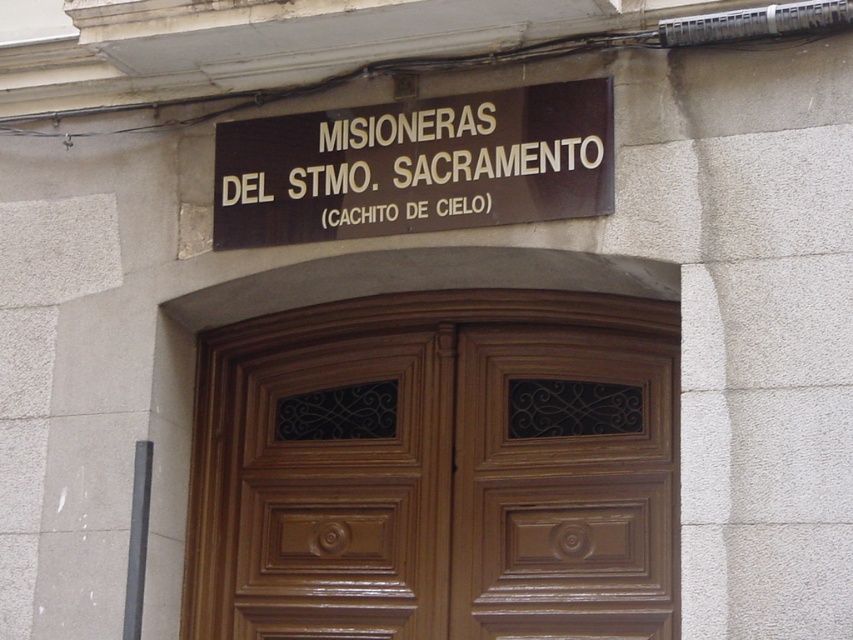
Question: Does glossy wood door at center appear on the right side of brown polished wood sign at upper center?

Choices:
 (A) yes
 (B) no

Answer: (A)

Question: Can you confirm if glossy wood door at center is smaller than brown polished wood sign at upper center?

Choices:
 (A) no
 (B) yes

Answer: (A)

Question: Considering the relative positions of glossy wood door at center and brown polished wood sign at upper center in the image provided, where is glossy wood door at center located with respect to brown polished wood sign at upper center?

Choices:
 (A) below
 (B) above

Answer: (A)